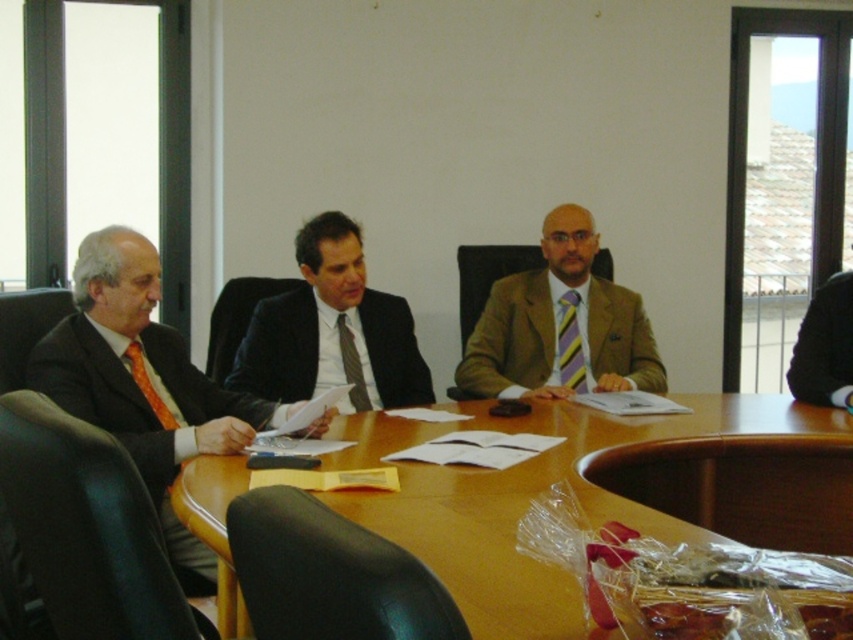
Question: Which of the following is the closest to the observer?

Choices:
 (A) yellow striped tie at center
 (B) dark gray suit at right

Answer: (B)

Question: Which point is closer to the camera?

Choices:
 (A) (151, 458)
 (B) (845, 323)
 (C) (352, 371)
 (D) (158, 410)

Answer: (A)

Question: Is matte black suit at center wider than dark gray suit at right?

Choices:
 (A) no
 (B) yes

Answer: (B)

Question: Does wooden at center have a greater width compared to dark gray suit at right?

Choices:
 (A) yes
 (B) no

Answer: (A)

Question: Which is farther from the matte black suit at center?

Choices:
 (A) wooden at center
 (B) matte black suit at left
 (C) orange silk tie at left
 (D) dark gray suit at right

Answer: (D)

Question: Does matte black suit at left have a greater width compared to matte black suit at center?

Choices:
 (A) yes
 (B) no

Answer: (A)